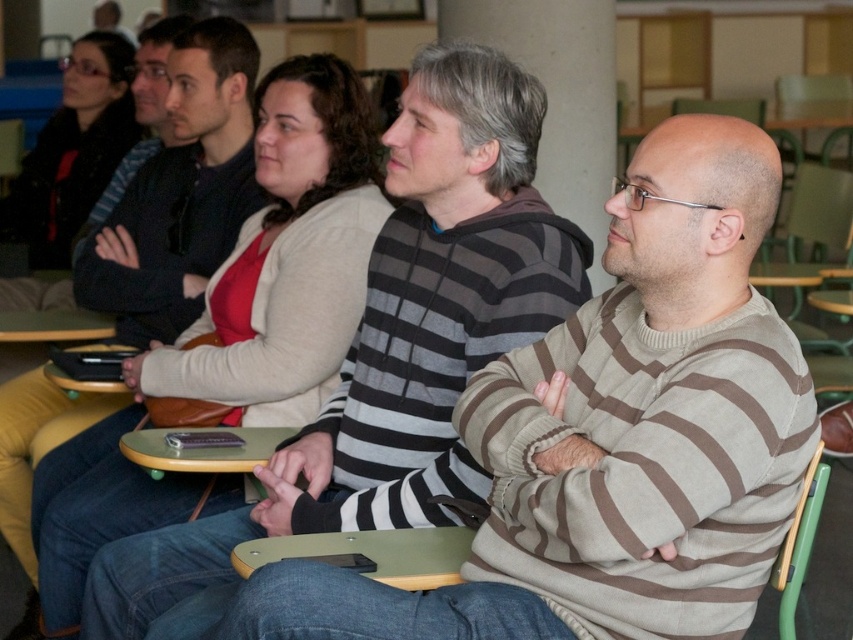
Who is shorter, striped sweater at center or matte beige sweater at center?

Standing shorter between the two is striped sweater at center.

Can you confirm if striped sweater at center is positioned to the left of matte beige sweater at center?

In fact, striped sweater at center is to the right of matte beige sweater at center.

Is point (764, 476) less distant than point (296, 180)?

Yes.

Locate an element on the screen. This screenshot has width=853, height=640. striped sweater at center is located at coordinates (614, 436).

In the scene shown: Is matte beige sweater at center to the right of green plastic chair at right from the viewer's perspective?

No, matte beige sweater at center is not to the right of green plastic chair at right.

Which is in front, point (36, 524) or point (817, 500)?

Point (817, 500) is more forward.

I want to click on matte beige sweater at center, so click(x=286, y=257).

Can you confirm if striped sweater at center is positioned above matte black jacket at upper left?

Actually, striped sweater at center is below matte black jacket at upper left.

Who is more forward, (694, 250) or (64, 262)?

Point (694, 250) is more forward.

Where is `striped sweater at center`? striped sweater at center is located at coordinates click(x=614, y=436).